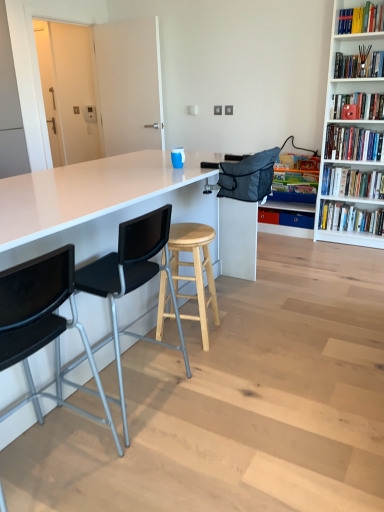
Identify the location of vacant space in front of black plastic chair at left, the second chair positioned from the front. (147, 460).